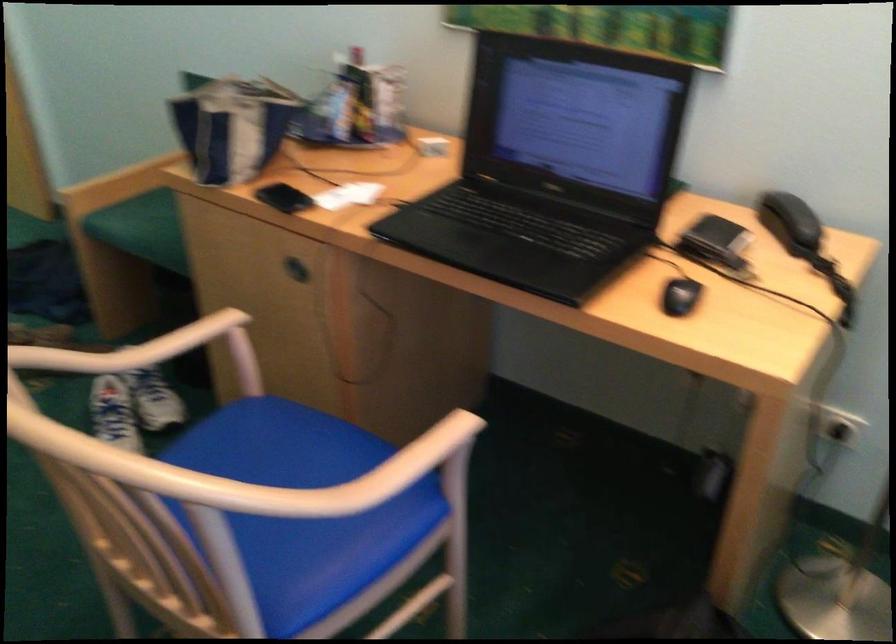
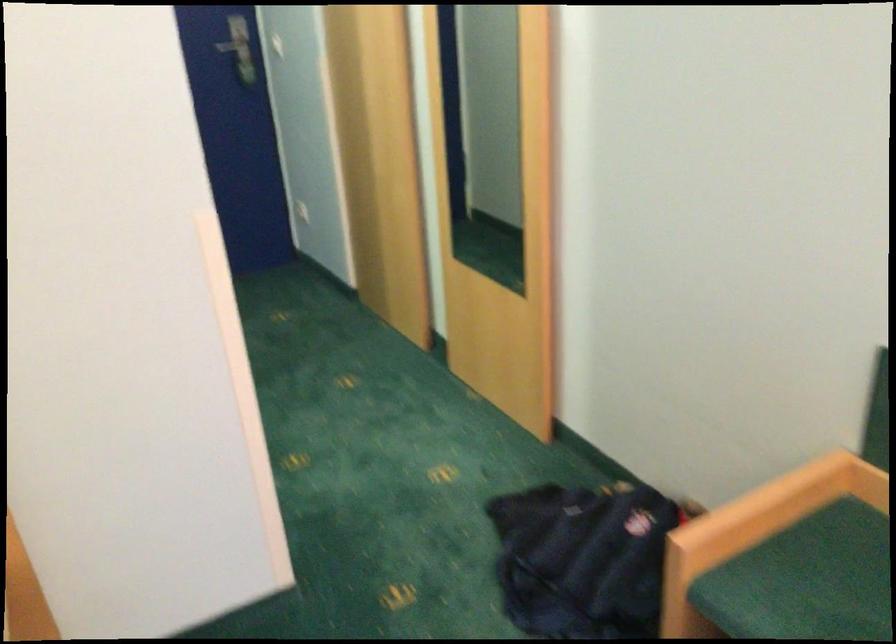
In the second image, find the point that corresponds to pixel 152 211 in the first image.

(806, 580)